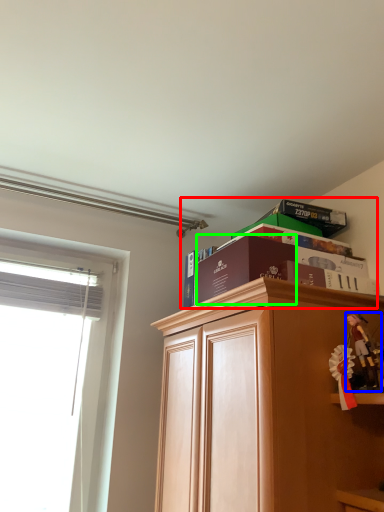
Question: Considering the real-world distances, which object is closest to book (highlighted by a red box)? toy (highlighted by a blue box) or paperback book (highlighted by a green box).

Choices:
 (A) toy
 (B) paperback book

Answer: (B)